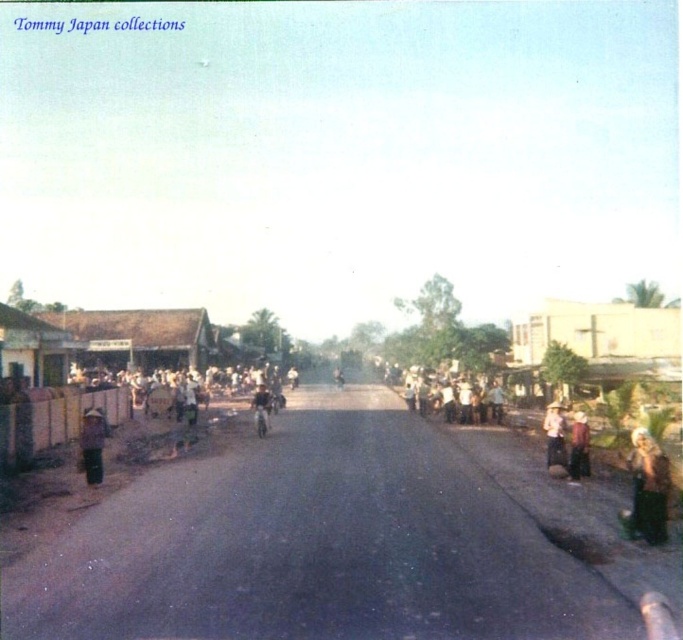
Is light brown hair at lower right shorter than brown fabric dress at right?

No, light brown hair at lower right is not shorter than brown fabric dress at right.

Is light brown hair at lower right to the left of brown fabric dress at right from the viewer's perspective?

Yes, light brown hair at lower right is to the left of brown fabric dress at right.

Where is `light brown hair at lower right`? light brown hair at lower right is located at coordinates (647, 490).

Which of these two, light brown hair at lower right or light brown straw hat at left, stands shorter?

light brown hair at lower right

Which is more to the left, light brown hair at lower right or light brown straw hat at left?

From the viewer's perspective, light brown straw hat at left appears more on the left side.

This screenshot has width=683, height=640. I want to click on light brown hair at lower right, so click(647, 490).

Can you confirm if light brown straw hat at left is positioned above light brown leather jacket at center?

Yes, light brown straw hat at left is above light brown leather jacket at center.

Where is `light brown straw hat at left`? This screenshot has height=640, width=683. light brown straw hat at left is located at coordinates click(92, 444).